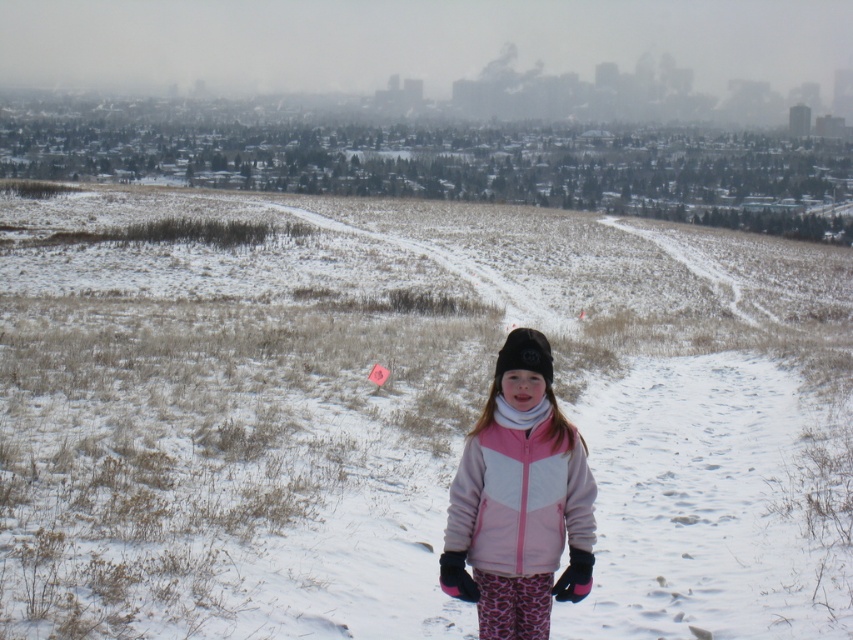
Question: Is white fluffy snow at center below pink fleece jacket at center?

Choices:
 (A) no
 (B) yes

Answer: (A)

Question: Is white fluffy snow at center smaller than pink fleece jacket at center?

Choices:
 (A) no
 (B) yes

Answer: (A)

Question: Which of the following is the farthest from the observer?

Choices:
 (A) (47, 484)
 (B) (527, 456)

Answer: (A)

Question: Which object appears closest to the camera in this image?

Choices:
 (A) white fluffy snow at center
 (B) pink fleece jacket at center

Answer: (B)

Question: Is white fluffy snow at center wider than pink fleece jacket at center?

Choices:
 (A) no
 (B) yes

Answer: (B)